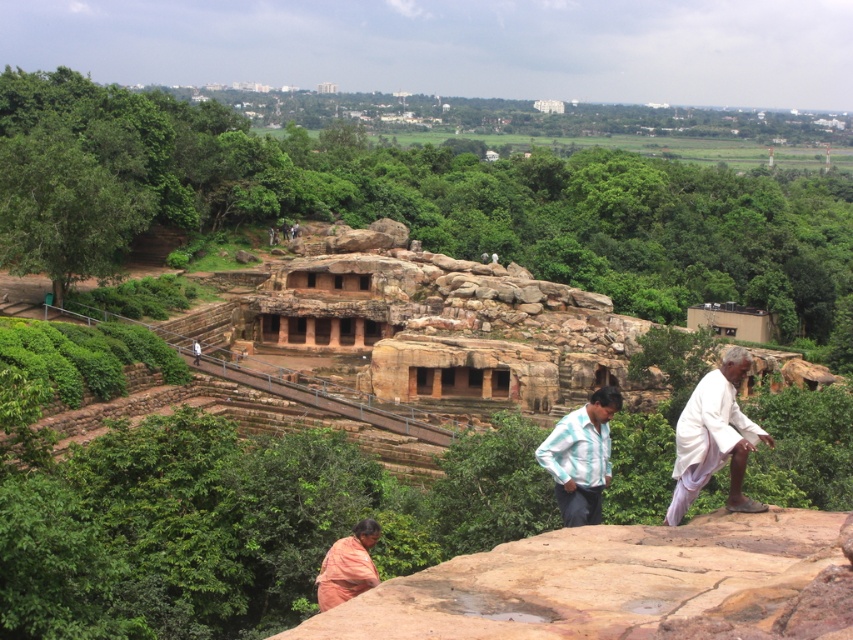
You are a tour guide leading a group through this ancient cave site. You notice two visitors dressed in traditional clothing. One is wearing a white cotton shirt at right, and the other is wearing an orange cotton sari at lower center. Which visitor is positioned higher up the path?

The white cotton shirt at right is located above the orange cotton sari at lower center, so the visitor in the white cotton shirt at right is positioned higher up the path.

You are a photographer planning to take a photo of the white cotton shirt at right and the camera. You want to ensure both subjects are in focus. Given that your camera has a depth of field that can cover 50 meters, will you be able to capture both subjects clearly in the same shot?

The white cotton shirt at right and camera are 55.78 meters apart from each other, which exceeds the camera depth of field of 50 meters. Therefore, it is unlikely both subjects will be in focus in the same shot.

You are a fashion designer observing the clothing in the scene. You need to create a new outfit that accommodates both the striped cotton shirt at center and the orange cotton sari at lower center. Which clothing item requires more fabric to make a similar garment?

The striped cotton shirt at center requires more fabric to make a similar garment because its width is larger than the orange cotton sari at lower center.